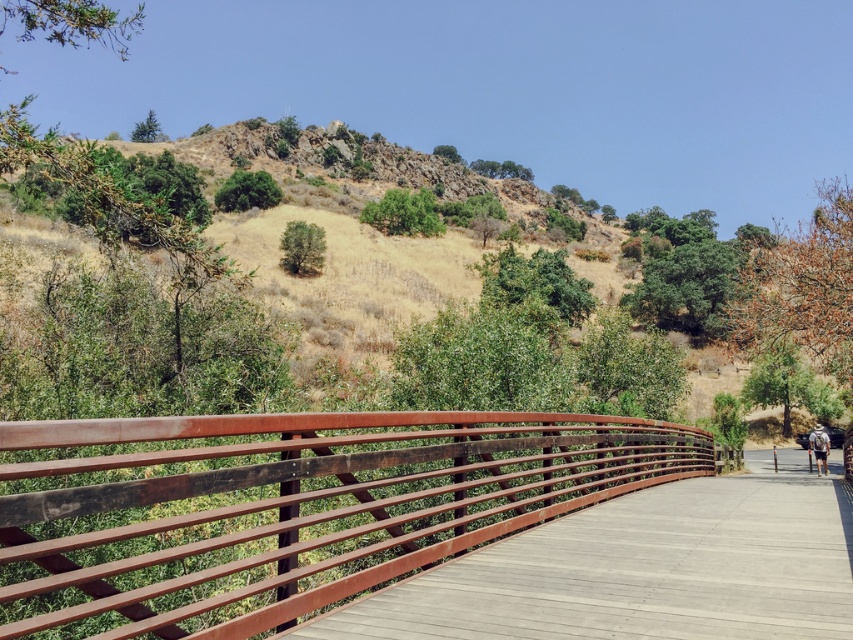
Measure the distance between rustic wood rail at center and wooden bridge at center.

rustic wood rail at center and wooden bridge at center are 2.62 meters apart from each other.

Between rustic wood rail at center and wooden bridge at center, which one is positioned lower?

wooden bridge at center

Which is in front, point (299, 540) or point (782, 579)?

Point (299, 540) is more forward.

Identify the location of rustic wood rail at center. pyautogui.click(x=285, y=508).

Does rustic wood rail at center appear over white fabric backpack at lower right?

Indeed, rustic wood rail at center is positioned over white fabric backpack at lower right.

Does rustic wood rail at center have a lesser height compared to white fabric backpack at lower right?

In fact, rustic wood rail at center may be taller than white fabric backpack at lower right.

Between point (12, 538) and point (816, 433), which one is positioned behind?

Positioned behind is point (816, 433).

Locate an element on the screen. rustic wood rail at center is located at coordinates (285, 508).

Can you confirm if wooden bridge at center is positioned to the left of white fabric backpack at lower right?

Correct, you'll find wooden bridge at center to the left of white fabric backpack at lower right.

Can you confirm if wooden bridge at center is smaller than white fabric backpack at lower right?

Indeed, wooden bridge at center has a smaller size compared to white fabric backpack at lower right.

Who is more forward, (840, 564) or (822, 454)?

Point (840, 564)

In order to click on wooden bridge at center in this screenshot , I will do `click(643, 568)`.